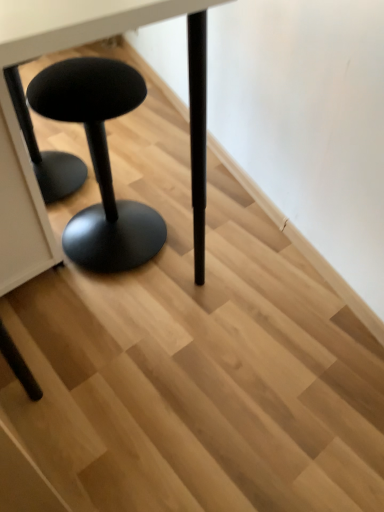
Describe the element at coordinates (17, 120) in the screenshot. Image resolution: width=384 pixels, height=512 pixels. I see `matte black stool at left` at that location.

At what (x,y) coordinates should I click in order to perform the action: click on matte black stool at left. Please return your answer as a coordinate pair (x, y). Image resolution: width=384 pixels, height=512 pixels. Looking at the image, I should click on (17, 120).

The height and width of the screenshot is (512, 384). I want to click on matte black stool at left, so click(17, 120).